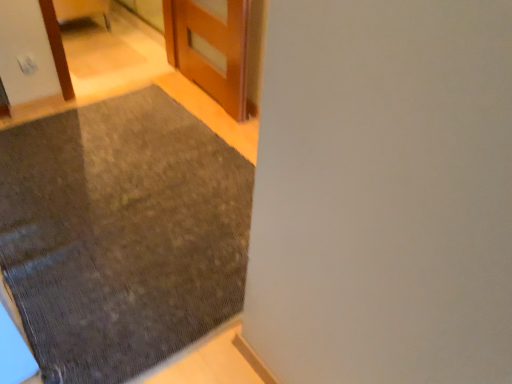
You are a GUI agent. You are given a task and a screenshot of the screen. Output one action in this format:
    pyautogui.click(x=<x>, y=<y>)
    Task: Click on the textured gray mat at lower left
    
    Given the screenshot: What is the action you would take?
    pyautogui.click(x=121, y=234)

This screenshot has height=384, width=512. What do you see at coordinates (121, 234) in the screenshot?
I see `textured gray mat at lower left` at bounding box center [121, 234].

The width and height of the screenshot is (512, 384). I want to click on wooden door at upper center, so click(211, 48).

Describe the element at coordinates (211, 48) in the screenshot. The width and height of the screenshot is (512, 384). I see `wooden door at upper center` at that location.

At what (x,y) coordinates should I click in order to perform the action: click on textured gray mat at lower left. Please return your answer as a coordinate pair (x, y). The height and width of the screenshot is (384, 512). Looking at the image, I should click on (121, 234).

Visually, is wooden door at upper center positioned to the left or to the right of textured gray mat at lower left?

wooden door at upper center is to the right of textured gray mat at lower left.

Is wooden door at upper center in front of or behind textured gray mat at lower left in the image?

Visually, wooden door at upper center is located behind textured gray mat at lower left.

Is point (170, 44) positioned behind point (134, 179)?

That is True.

From the image's perspective, relative to textured gray mat at lower left, is wooden door at upper center above or below?

Based on their image positions, wooden door at upper center is located above textured gray mat at lower left.

From a real-world perspective, which is physically below, wooden door at upper center or textured gray mat at lower left?

From a 3D spatial view, textured gray mat at lower left is below.

Considering the relative sizes of wooden door at upper center and textured gray mat at lower left in the image provided, is wooden door at upper center thinner than textured gray mat at lower left?

Correct, the width of wooden door at upper center is less than that of textured gray mat at lower left.

In the scene shown: Between wooden door at upper center and textured gray mat at lower left, which one has more height?

wooden door at upper center is taller.

Between wooden door at upper center and textured gray mat at lower left, which one has smaller size?

wooden door at upper center.

Is wooden door at upper center outside of textured gray mat at lower left?

Indeed, wooden door at upper center is completely outside textured gray mat at lower left.

Is wooden door at upper center far from textured gray mat at lower left?

No, wooden door at upper center is not far away from textured gray mat at lower left.

Could you tell me if wooden door at upper center is facing textured gray mat at lower left?

Yes, wooden door at upper center is aimed at textured gray mat at lower left.

Identify the location of door lying above the textured gray mat at lower left (from the image's perspective). Image resolution: width=512 pixels, height=384 pixels. (211, 48).

Is textured gray mat at lower left at the left side of wooden door at upper center?

Correct, you'll find textured gray mat at lower left to the left of wooden door at upper center.

Relative to wooden door at upper center, is textured gray mat at lower left in front or behind?

textured gray mat at lower left is in front of wooden door at upper center.

Is point (67, 153) less distant than point (174, 56)?

That is True.

Looking at this image, from the image's perspective, is textured gray mat at lower left positioned above or below wooden door at upper center?

textured gray mat at lower left is below wooden door at upper center.

From a real-world perspective, who is located higher, textured gray mat at lower left or wooden door at upper center?

In real-world perspective, wooden door at upper center is above.

Looking at their sizes, would you say textured gray mat at lower left is wider or thinner than wooden door at upper center?

Considering their sizes, textured gray mat at lower left looks broader than wooden door at upper center.

In terms of height, does textured gray mat at lower left look taller or shorter compared to wooden door at upper center?

Considering their sizes, textured gray mat at lower left has less height than wooden door at upper center.

Considering the relative sizes of textured gray mat at lower left and wooden door at upper center in the image provided, is textured gray mat at lower left bigger than wooden door at upper center?

Correct, textured gray mat at lower left is larger in size than wooden door at upper center.

Choose the correct answer: Is textured gray mat at lower left inside wooden door at upper center or outside it?

textured gray mat at lower left cannot be found inside wooden door at upper center.

Is textured gray mat at lower left next to wooden door at upper center and touching it?

No.

Is wooden door at upper center at the back of textured gray mat at lower left?

textured gray mat at lower left does not have its back to wooden door at upper center.

Identify the location of mat below the wooden door at upper center (from the image's perspective). (121, 234).

Locate an element on the screen. Image resolution: width=512 pixels, height=384 pixels. mat located below the wooden door at upper center (from the image's perspective) is located at coordinates (121, 234).

Where is `door behind the textured gray mat at lower left`? door behind the textured gray mat at lower left is located at coordinates (211, 48).